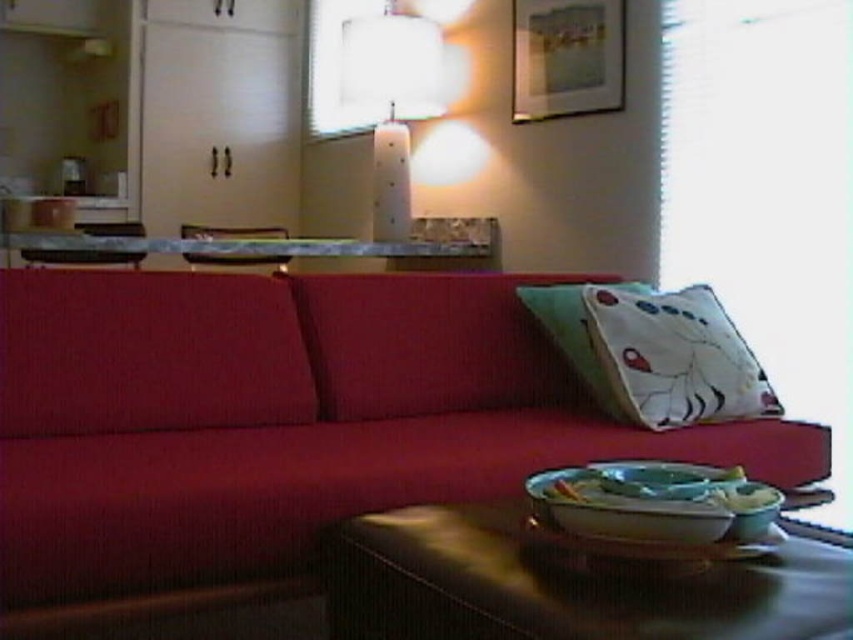
You are a guest sitting in a chair facing the velvet red couch at center and the white cotton pillow at center. Which object is nearer to you?

The velvet red couch at center is closer to you than the white cotton pillow at center.

You are a delivery robot that is 6 inches wide. You need to move from the left side of the white cotton pillow at center to the right side of the white cotton pillow at right. Can you fit through the space between them?

The distance between the white cotton pillow at center and the white cotton pillow at right is 6.53 inches, which is wider than the robot width of 6 inches. Therefore, the delivery robot can fit through the space between them.